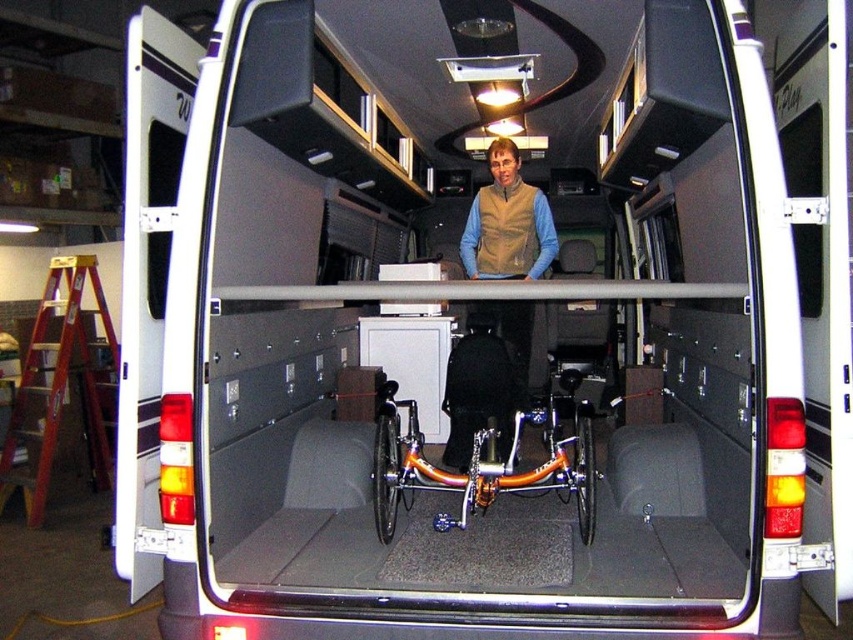
You are a delivery person who just entered the van and need to locate your beige fleece vest at center. You see the matte black wheelchair at center. Which side of the wheelchair should you check to find your vest?

The beige fleece vest at center is to the right of the matte black wheelchair at center, so you should check the right side of the wheelchair.

Consider the image. You are a delivery person who needs to load a package between the orange metallic bicycle at center and the matte black wheelchair at center. The package is 10 inches wide. Can it fit in the space between them?

The space between the orange metallic bicycle at center and the matte black wheelchair at center is 10.15 inches. Since the package is 10 inches wide, it can fit in the space between them.